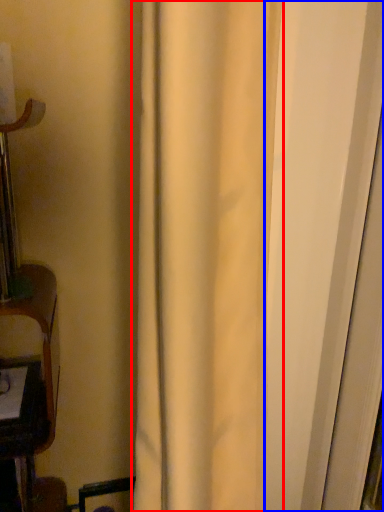
Question: Which of the following is the closest to the observer, curtain (highlighted by a red box) or screen door (highlighted by a blue box)?

Choices:
 (A) curtain
 (B) screen door

Answer: (A)